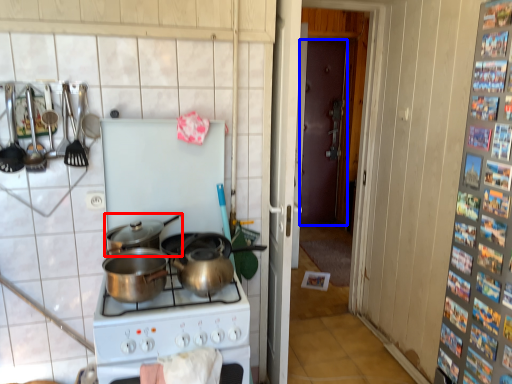
Question: Among these objects, which one is nearest to the camera, kitchen appliance (highlighted by a red box) or door (highlighted by a blue box)?

Choices:
 (A) kitchen appliance
 (B) door

Answer: (A)